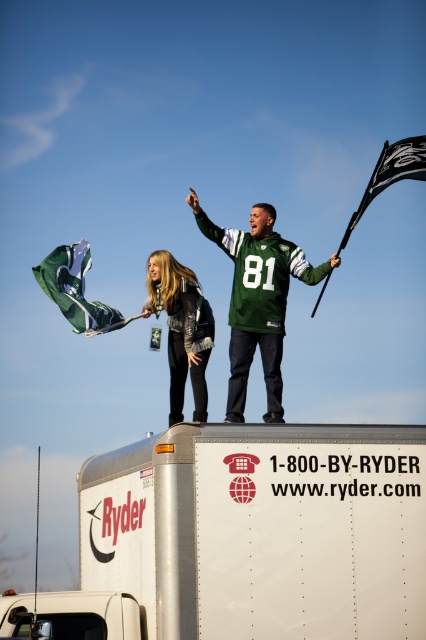
You are a photographer trying to capture a clear photo of both the green jersey at center and the leather jacket at center. Since you want both to be visible, which one should you focus on to ensure the larger object is in focus?

You should focus on the green jersey at center because it is bigger than the leather jacket at center, ensuring the larger object is in focus.

You are a photographer taking a picture of the Ryder truck with the two flags. Which flag should you focus on first if you want to capture both flags in the frame without moving the camera? Please choose between the green fabric flag at upper center and the black fabric flag at upper right based on their positions.

The green fabric flag at upper center is positioned on the left side of the black fabric flag at upper right, so focusing on the green fabric flag at upper center first would allow you to frame both flags without needing to adjust the camera position.